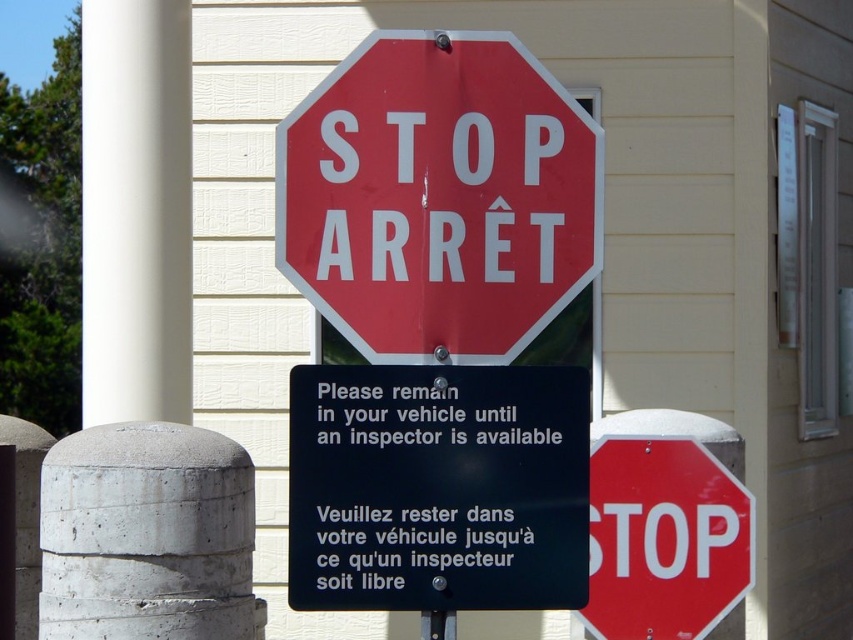
Question: Which point is farther from the camera taking this photo?

Choices:
 (A) (403, 586)
 (B) (314, 272)

Answer: (A)

Question: Is black plastic sign at center wider than red glossy stop sign at center?

Choices:
 (A) no
 (B) yes

Answer: (B)

Question: Which object is positioned closest to the red matte stop sign at center?

Choices:
 (A) red glossy stop sign at center
 (B) black plastic sign at center
 (C) concrete at left
 (D) metallic pole at center

Answer: (B)

Question: Observing the image, what is the correct spatial positioning of red matte stop sign at center in reference to black plastic sign at center?

Choices:
 (A) above
 (B) below

Answer: (A)

Question: Which point is closer to the camera?

Choices:
 (A) red glossy stop sign at center
 (B) black plastic sign at center
 (C) concrete at left

Answer: (B)

Question: Does white concrete pillar at upper left appear under metallic pole at center?

Choices:
 (A) yes
 (B) no

Answer: (B)